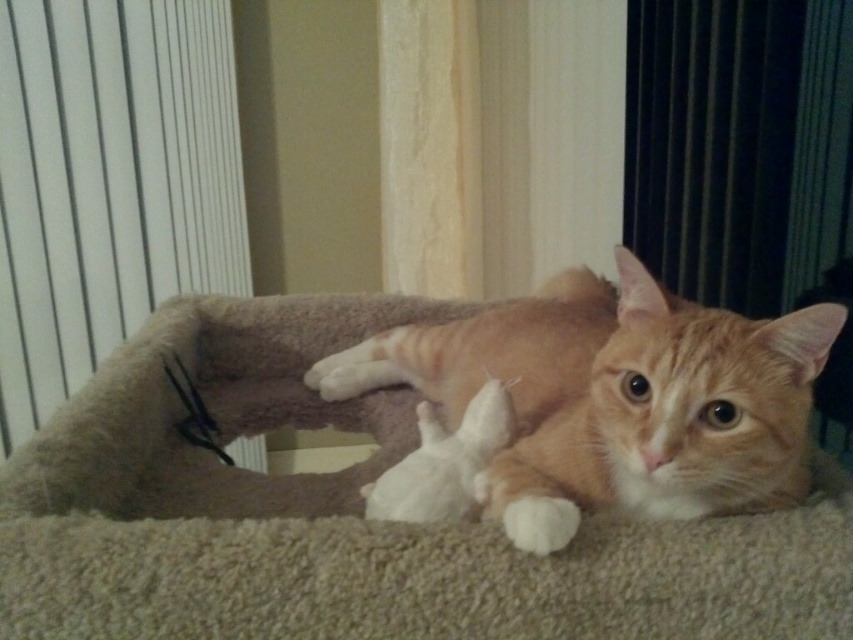
Question: Which point is closer to the camera?

Choices:
 (A) pyautogui.click(x=762, y=416)
 (B) pyautogui.click(x=799, y=552)

Answer: (B)

Question: Does beige plush cat bed at center appear under orange fur cat at center?

Choices:
 (A) yes
 (B) no

Answer: (A)

Question: Is beige plush cat bed at center wider than orange fur cat at center?

Choices:
 (A) no
 (B) yes

Answer: (B)

Question: Is beige plush cat bed at center bigger than orange fur cat at center?

Choices:
 (A) no
 (B) yes

Answer: (B)

Question: Which point appears farthest from the camera in this image?

Choices:
 (A) (123, 625)
 (B) (631, 356)

Answer: (B)